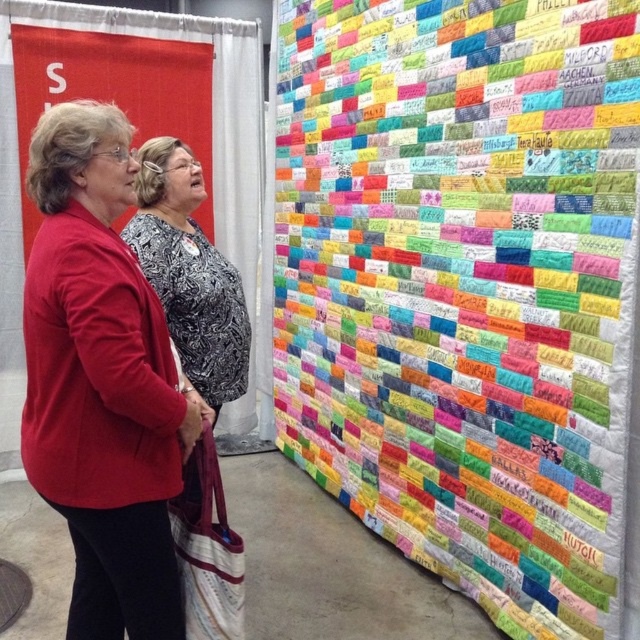
Question: Which point is farther to the camera?

Choices:
 (A) patterned fabric blouse at center
 (B) colorful fabric quilt at upper right
 (C) matte red cardigan at center

Answer: (A)

Question: Which of the following is the closest to the observer?

Choices:
 (A) (129, 292)
 (B) (228, 369)
 (C) (387, 282)

Answer: (A)

Question: Can you confirm if colorful fabric quilt at upper right is positioned to the left of matte red cardigan at center?

Choices:
 (A) no
 (B) yes

Answer: (A)

Question: Is colorful fabric quilt at upper right bigger than patterned fabric blouse at center?

Choices:
 (A) no
 (B) yes

Answer: (B)

Question: Does colorful fabric quilt at upper right have a smaller size compared to patterned fabric blouse at center?

Choices:
 (A) yes
 (B) no

Answer: (B)

Question: Which object is closer to the camera taking this photo?

Choices:
 (A) colorful fabric quilt at upper right
 (B) patterned fabric blouse at center

Answer: (A)